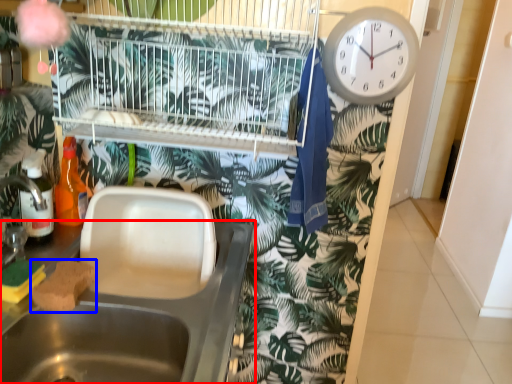
Question: Among these objects, which one is nearest to the camera, sink (highlighted by a red box) or food (highlighted by a blue box)?

Choices:
 (A) sink
 (B) food

Answer: (A)